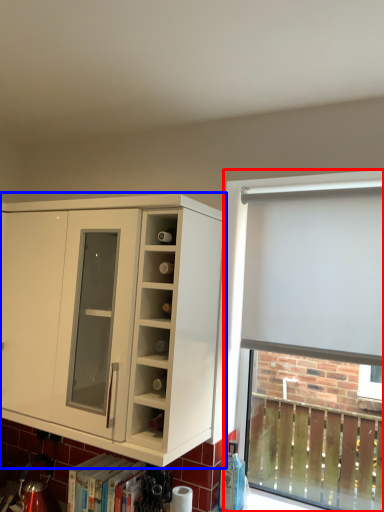
Question: Which point is closer to the camera, bay window (highlighted by a red box) or cabinetry (highlighted by a blue box)?

Choices:
 (A) bay window
 (B) cabinetry

Answer: (B)